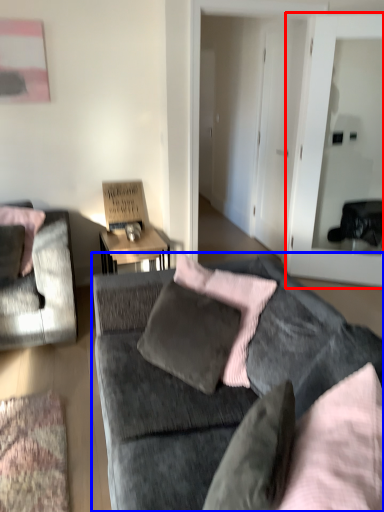
Question: Which point is further to the camera, glass door (highlighted by a red box) or studio couch (highlighted by a blue box)?

Choices:
 (A) glass door
 (B) studio couch

Answer: (A)